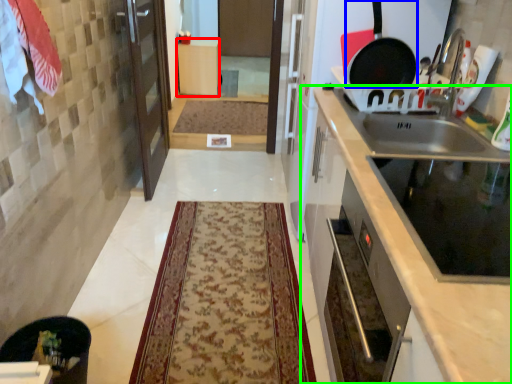
Question: Which is nearer to the cabinetry (highlighted by a red box)? frying pan (highlighted by a blue box) or cabinetry (highlighted by a green box).

Choices:
 (A) frying pan
 (B) cabinetry

Answer: (A)